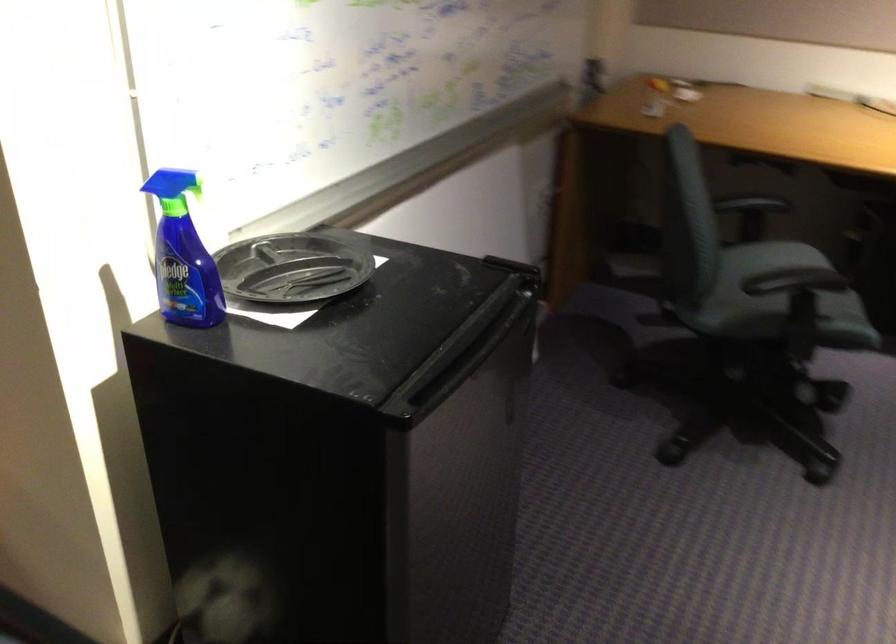
Identify the location of refrigerator door handle. (479, 351).